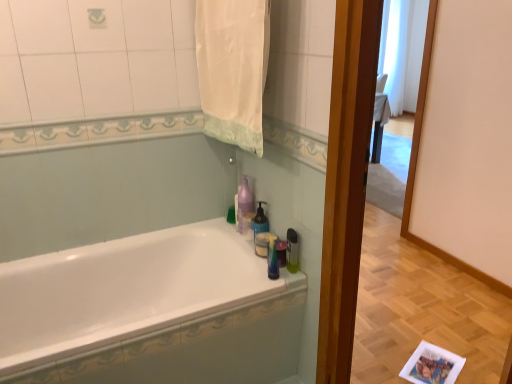
Question: Is translucent plastic soap dispenser at right bigger than white fabric towel at upper center?

Choices:
 (A) no
 (B) yes

Answer: (A)

Question: Is translucent plastic soap dispenser at right behind white fabric towel at upper center?

Choices:
 (A) yes
 (B) no

Answer: (A)

Question: Does translucent plastic soap dispenser at right have a lesser width compared to white fabric towel at upper center?

Choices:
 (A) yes
 (B) no

Answer: (A)

Question: Is translucent plastic soap dispenser at right not within white fabric towel at upper center?

Choices:
 (A) no
 (B) yes

Answer: (B)

Question: Can you confirm if translucent plastic soap dispenser at right is shorter than white fabric towel at upper center?

Choices:
 (A) no
 (B) yes

Answer: (B)

Question: Considering the positions of translucent plastic soap dispenser at right and translucent plastic soap dispenser at upper center in the image, is translucent plastic soap dispenser at right bigger or smaller than translucent plastic soap dispenser at upper center?

Choices:
 (A) small
 (B) big

Answer: (A)

Question: Is point (292, 231) closer or farther from the camera than point (260, 221)?

Choices:
 (A) farther
 (B) closer

Answer: (B)

Question: From the image's perspective, is translucent plastic soap dispenser at right positioned above or below translucent plastic soap dispenser at upper center?

Choices:
 (A) above
 (B) below

Answer: (B)

Question: In the image, is translucent plastic soap dispenser at right on the left side or the right side of translucent plastic soap dispenser at upper center?

Choices:
 (A) left
 (B) right

Answer: (B)

Question: Looking at the image, does purple glossy bottle at upper center seem bigger or smaller compared to translucent plastic soap dispenser at right?

Choices:
 (A) small
 (B) big

Answer: (B)

Question: Is purple glossy bottle at upper center inside or outside of translucent plastic soap dispenser at right?

Choices:
 (A) inside
 (B) outside

Answer: (B)

Question: Considering the positions of point (241, 211) and point (293, 248), is point (241, 211) closer or farther from the camera than point (293, 248)?

Choices:
 (A) farther
 (B) closer

Answer: (A)

Question: Relative to translucent plastic soap dispenser at right, is purple glossy bottle at upper center in front or behind?

Choices:
 (A) behind
 (B) front

Answer: (A)

Question: From a real-world perspective, is translucent plastic soap dispenser at upper center physically located above or below translucent plastic soap dispenser at right?

Choices:
 (A) below
 (B) above

Answer: (B)

Question: Would you say translucent plastic soap dispenser at upper center is to the left or to the right of translucent plastic soap dispenser at right in the picture?

Choices:
 (A) left
 (B) right

Answer: (A)